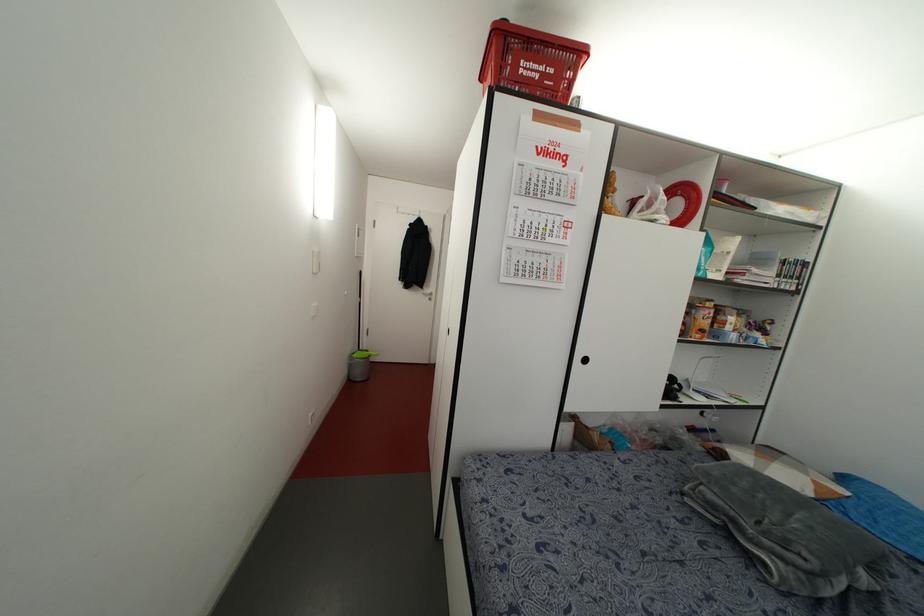
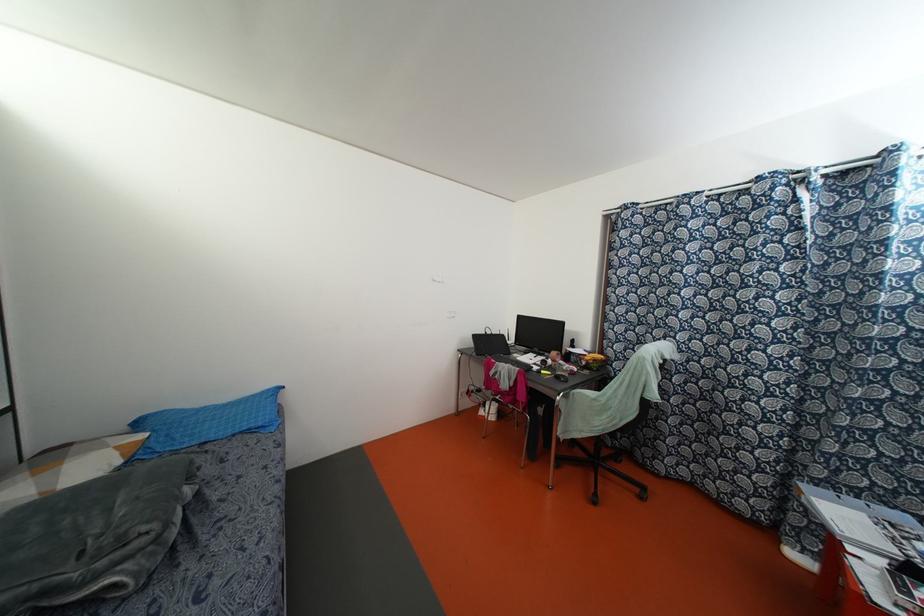
Locate, in the second image, the point that corresponds to (x=810, y=493) in the first image.

(118, 461)